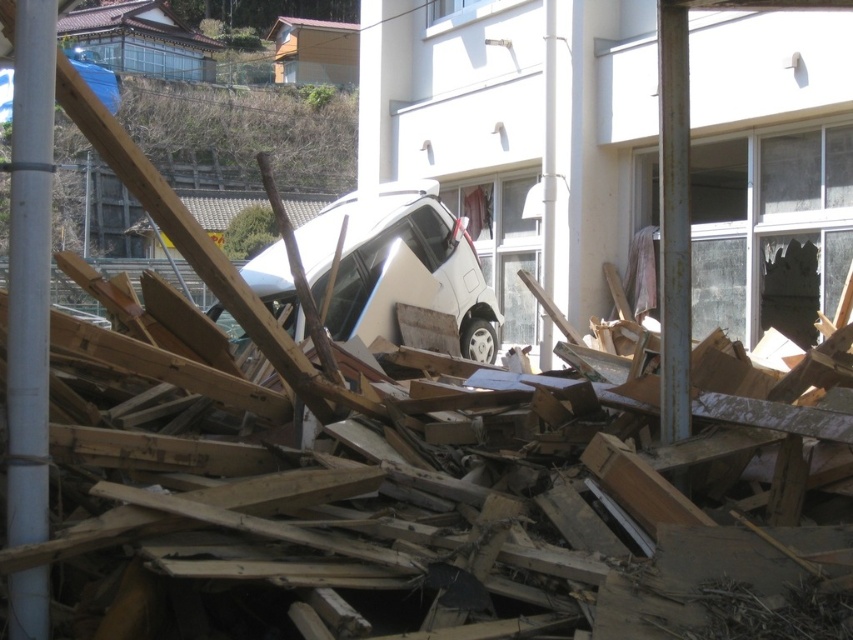
Question: Is white smooth pipe at center left further to the viewer compared to white matte van at center?

Choices:
 (A) no
 (B) yes

Answer: (A)

Question: Which object is positioned closest to the white smooth pipe at center left?

Choices:
 (A) white matte van at center
 (B) white matte car at center

Answer: (B)

Question: Which point appears farthest from the camera in this image?

Choices:
 (A) (28, 481)
 (B) (492, 353)

Answer: (B)

Question: Is white smooth pipe at center left bigger than white matte van at center?

Choices:
 (A) no
 (B) yes

Answer: (A)

Question: Is white smooth pipe at center left to the right of white matte van at center from the viewer's perspective?

Choices:
 (A) no
 (B) yes

Answer: (B)

Question: Which point is closer to the camera taking this photo?

Choices:
 (A) (32, 342)
 (B) (9, 84)
 (C) (468, 296)

Answer: (A)